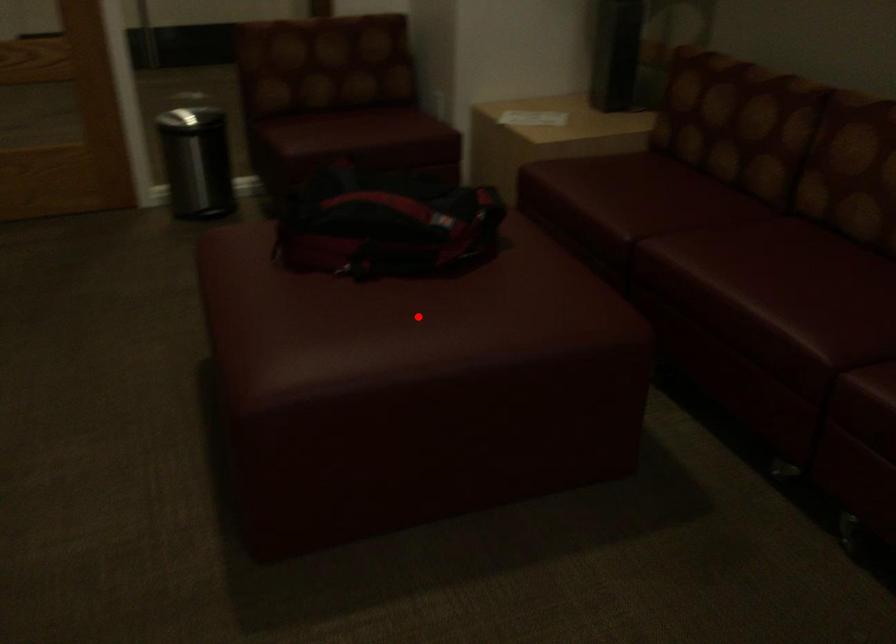
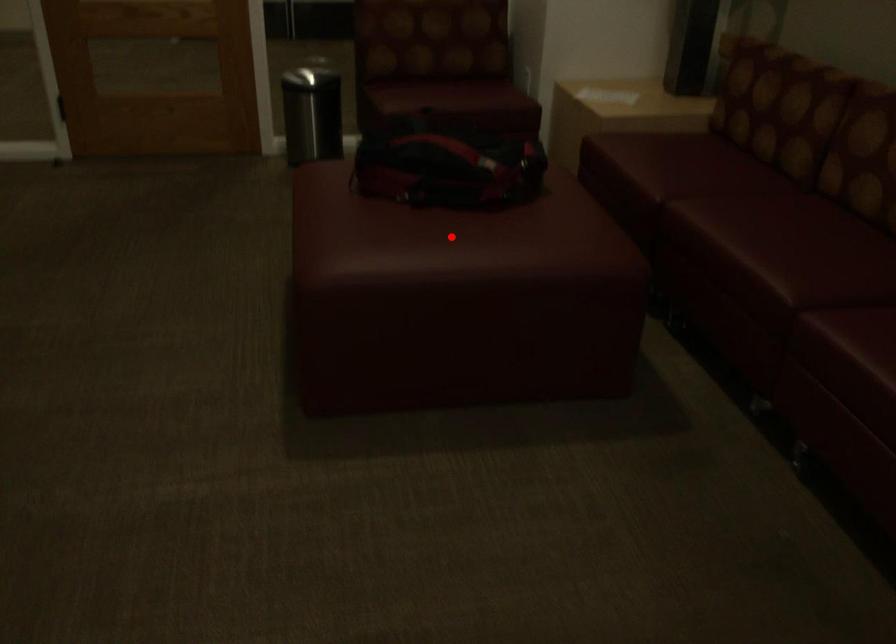
I am providing you with two images of the same scene from different viewpoints. A red point is marked on the first image and another point is marked on the second image. Is the red point in image1 aligned with the point shown in image2?

Yes